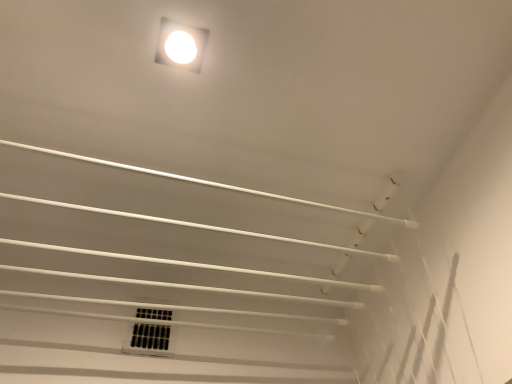
Question: Is white glossy light fixture at upper center inside or outside of white plastic vent at center?

Choices:
 (A) outside
 (B) inside

Answer: (A)

Question: From a real-world perspective, is white glossy light fixture at upper center physically located above or below white plastic vent at center?

Choices:
 (A) above
 (B) below

Answer: (A)

Question: Considering the relative positions of white glossy light fixture at upper center and white plastic vent at center in the image provided, is white glossy light fixture at upper center to the left or to the right of white plastic vent at center?

Choices:
 (A) left
 (B) right

Answer: (B)

Question: Considering the positions of point 123,344 and point 174,31, is point 123,344 closer or farther from the camera than point 174,31?

Choices:
 (A) farther
 (B) closer

Answer: (A)

Question: From the image's perspective, is white plastic vent at center above or below white glossy light fixture at upper center?

Choices:
 (A) above
 (B) below

Answer: (B)

Question: Considering their positions, is white plastic vent at center located in front of or behind white glossy light fixture at upper center?

Choices:
 (A) behind
 (B) front

Answer: (A)

Question: Is white plastic vent at center wider or thinner than white glossy light fixture at upper center?

Choices:
 (A) wide
 (B) thin

Answer: (B)